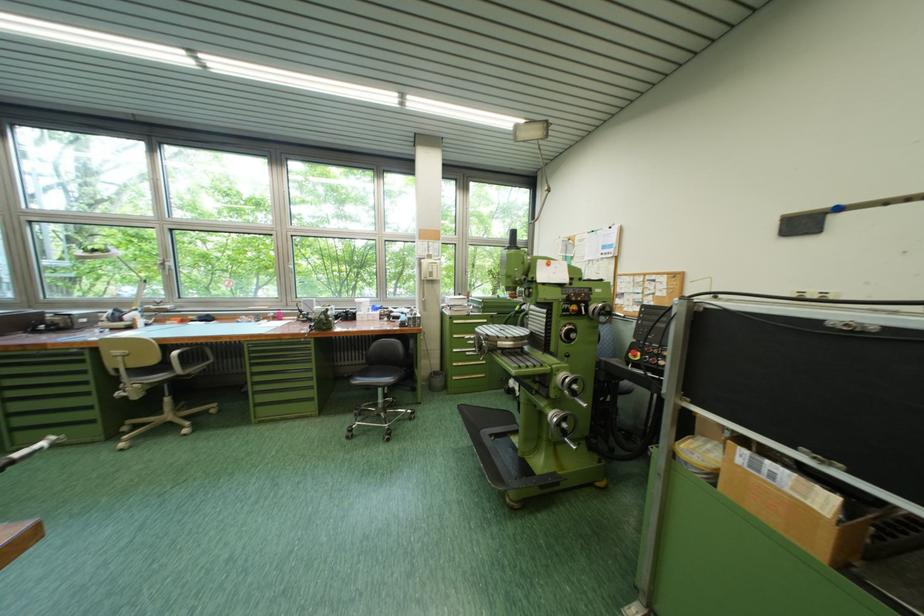
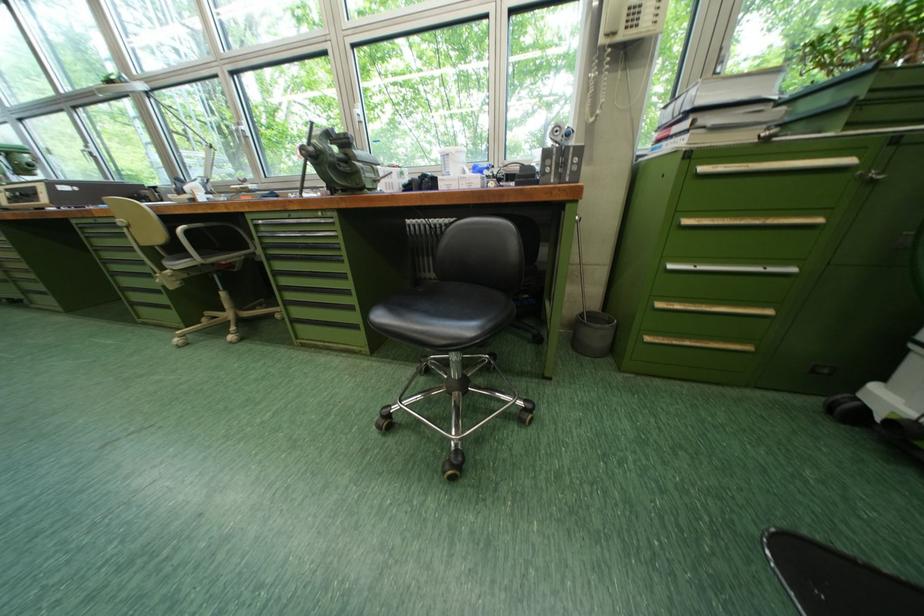
The point at (465, 353) is marked in the first image. Where is the corresponding point in the second image?

(681, 269)